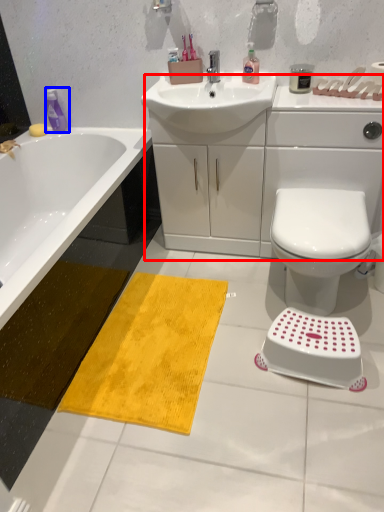
Question: Which object appears farthest to the camera in this image, counter top (highlighted by a red box) or cleaning product (highlighted by a blue box)?

Choices:
 (A) counter top
 (B) cleaning product

Answer: (B)